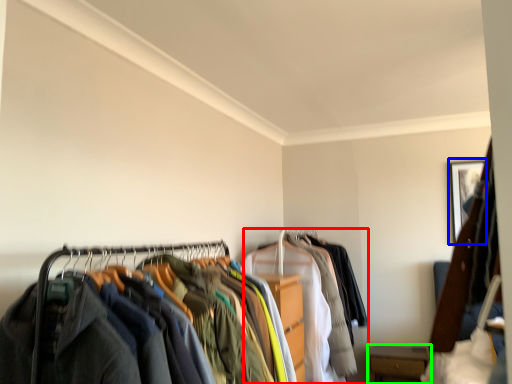
Question: Which object is positioned closest to garment (highlighted by a red box)? Select from picture frame (highlighted by a blue box) and furniture (highlighted by a green box).

Choices:
 (A) picture frame
 (B) furniture

Answer: (B)